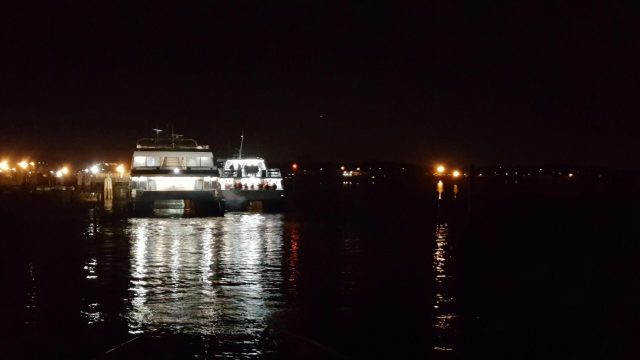
You are a GUI agent. You are given a task and a screenshot of the screen. Output one action in this format:
    pyautogui.click(x=<x>, y=<y>)
    Task: Click on the light
    This screenshot has width=640, height=360.
    Given the screenshot: What is the action you would take?
    pyautogui.click(x=436, y=171), pyautogui.click(x=460, y=175)